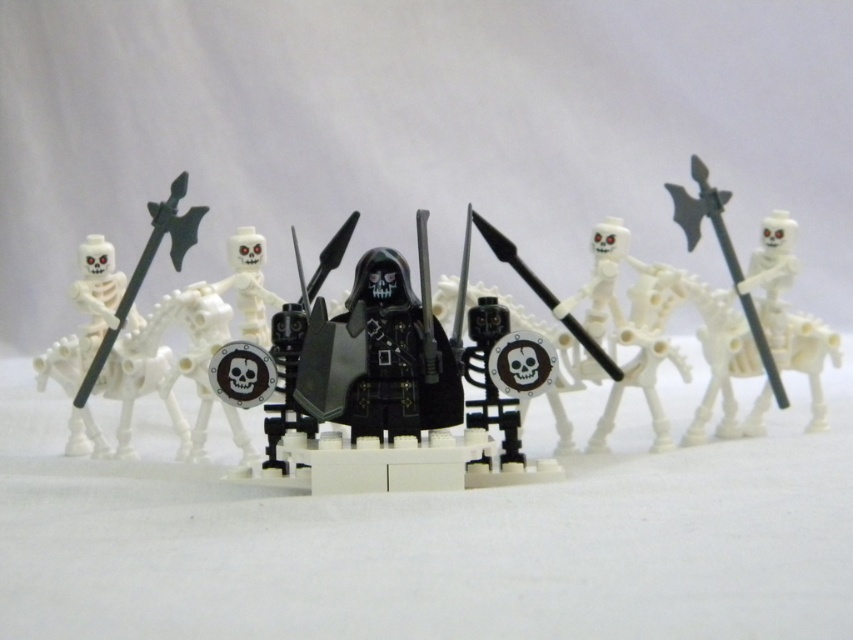
Question: Considering the relative positions of black matte armor at center and black plastic axe at right in the image provided, where is black matte armor at center located with respect to black plastic axe at right?

Choices:
 (A) right
 (B) left

Answer: (B)

Question: Among these objects, which one is farthest from the camera?

Choices:
 (A) black matte armor at center
 (B) black plastic axe at right

Answer: (B)

Question: Does smooth white skeleton at center have a lesser width compared to black plastic spear at center?

Choices:
 (A) yes
 (B) no

Answer: (A)

Question: Which point is farther to the camera?

Choices:
 (A) (114, 330)
 (B) (496, 248)
 (C) (473, 449)
 (D) (709, 220)

Answer: (D)

Question: Which of the following is the farthest from the observer?

Choices:
 (A) (566, 317)
 (B) (213, 342)
 (C) (265, 316)

Answer: (C)

Question: Is the position of black matte armor at center more distant than that of smooth white skeleton at center?

Choices:
 (A) yes
 (B) no

Answer: (B)